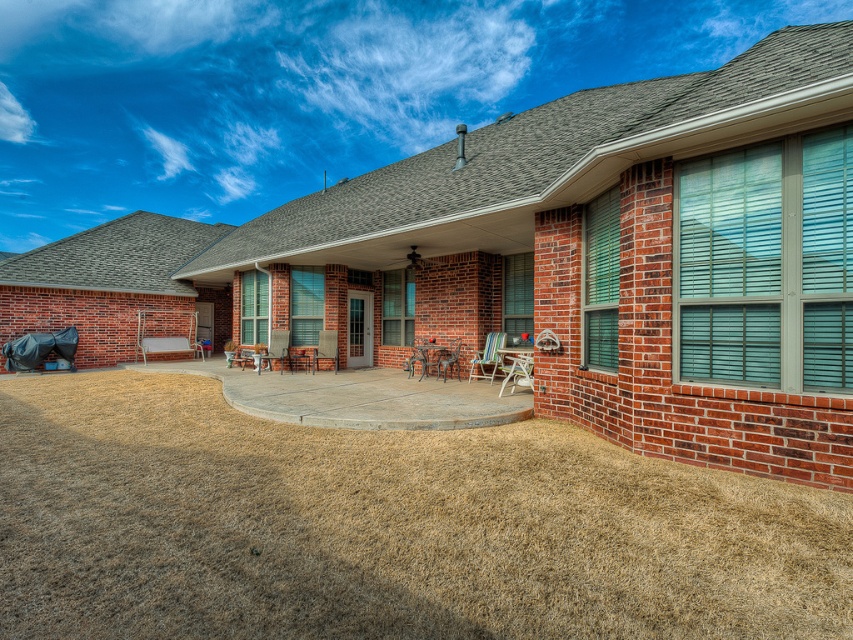
You are planning to set up a garden in the backyard and want to place a new flower bed. Given the positions of the brown grass at lower left and the metallic silver chair at center, where should you place the flower bed to avoid the existing brown grass?

The flower bed should be placed near the metallic silver chair at center since the brown grass at lower left is located below it and you want to avoid that area.

You are planning to set up a small garden on the brown brick patio at center. However, there is a multicolored plastic chair at center in the way. Based on the scene description, can you determine if the chair is placed on top of the patio or underneath it?

The brown brick patio at center is above the multicolored plastic chair at center, meaning the chair is placed underneath the patio. Therefore, the chair is not on top of the patio but rather positioned below it, so you can proceed to set up the garden on the patio without moving the chair.